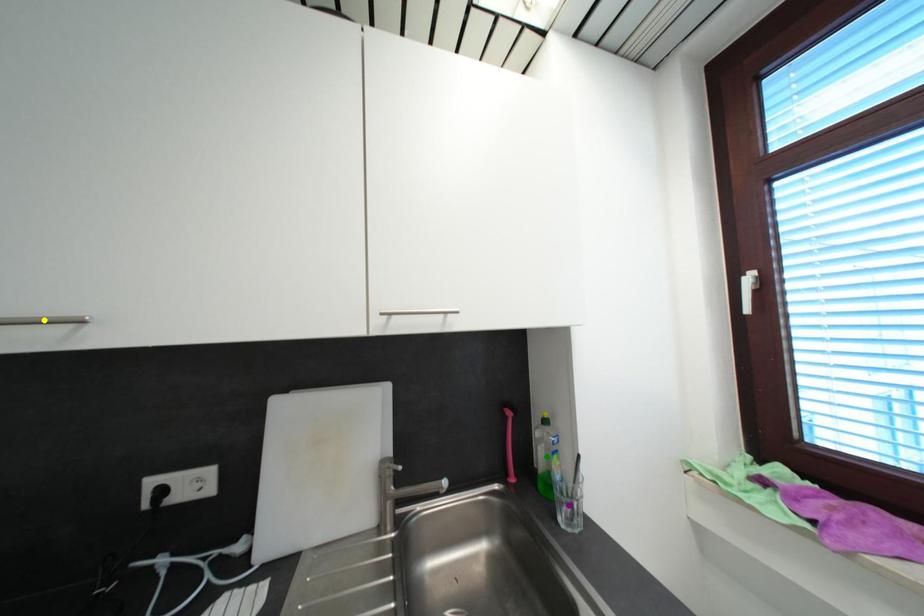
Order these from farthest to nearest:
- yellow point
- purple point
- green point

1. green point
2. purple point
3. yellow point